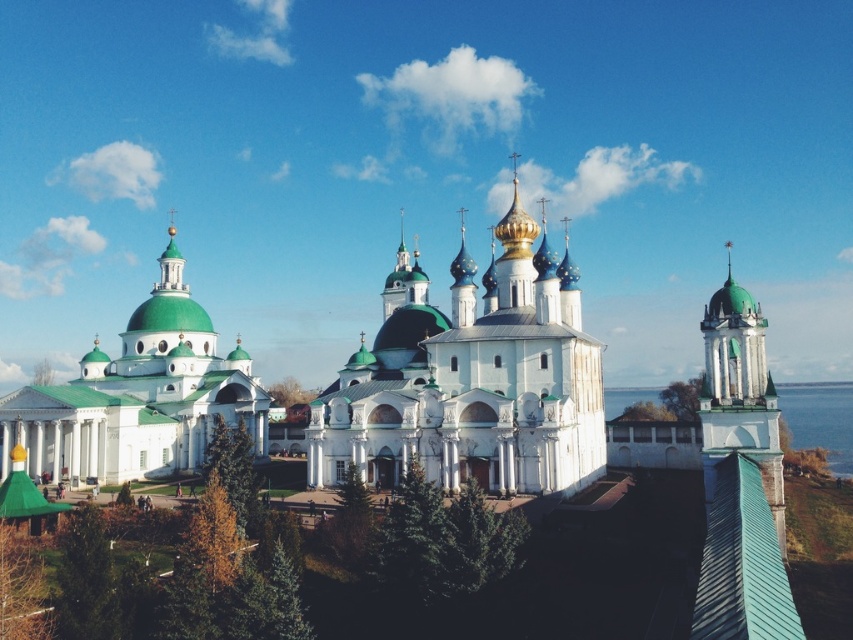
Which is behind, point (496, 268) or point (107, 472)?

Point (496, 268)

Identify the location of white stone church at center. (471, 378).

Who is higher up, green glazed tower at right or blue water at tower right?

green glazed tower at right is higher up.

Does point (751, 420) come farther from viewer compared to point (830, 410)?

No, it is not.

This screenshot has width=853, height=640. I want to click on green glazed tower at right, so click(740, 394).

Can you confirm if white glossy church at left is positioned above green glazed tower at right?

No, white glossy church at left is not above green glazed tower at right.

Does point (204, 355) lie in front of point (701, 406)?

That is False.

Looking at this image, who is more forward, (109, 452) or (766, 321)?

Point (766, 321) is more forward.

Find the location of `white glossy church at left`. white glossy church at left is located at coordinates (138, 397).